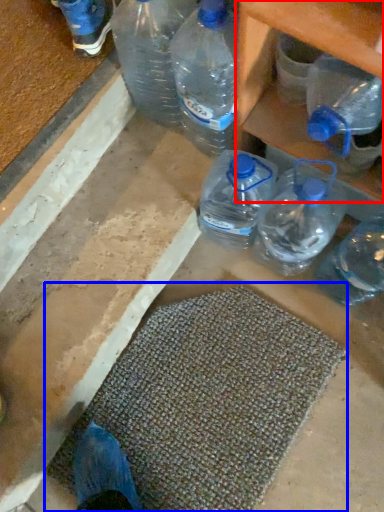
Question: Among these objects, which one is nearest to the camera, shelf (highlighted by a red box) or bath mat (highlighted by a blue box)?

Choices:
 (A) shelf
 (B) bath mat

Answer: (A)